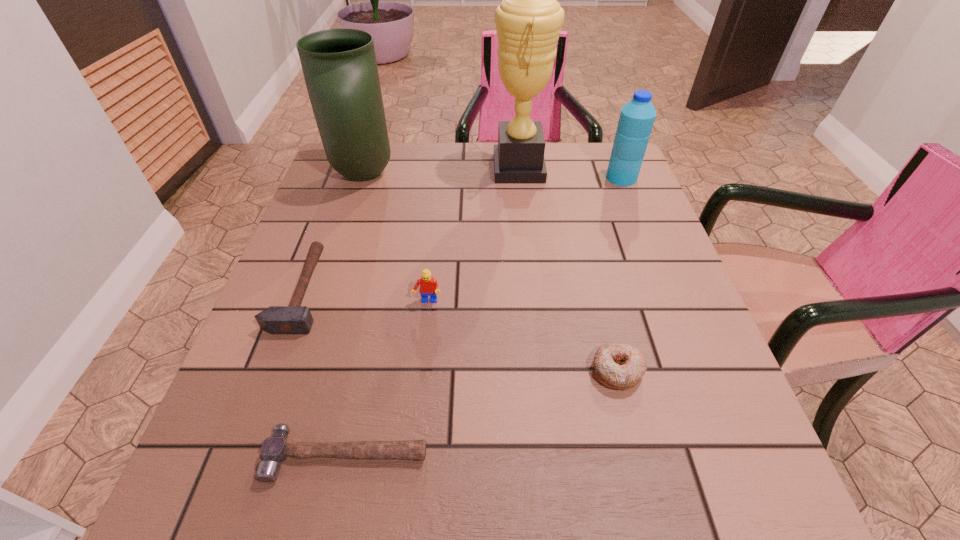
The width and height of the screenshot is (960, 540). In the image, there is a desktop. Find the location of `free space at the near edge`. free space at the near edge is located at coordinates (460, 485).

This screenshot has height=540, width=960. Identify the location of vacant point at the left edge. (343, 338).

The height and width of the screenshot is (540, 960). I want to click on free space at the right edge of the desktop, so click(659, 236).

In the image, there is a desktop. Identify the location of vacant space at the far left corner. (383, 173).

Locate an element on the screen. free space at the near left corner of the desktop is located at coordinates (214, 513).

The image size is (960, 540). Identify the location of free space at the far right corner. (608, 180).

What are the coordinates of `unoccupied area between the farther hammer and the fourth shortest object` in the screenshot? It's located at (365, 296).

Image resolution: width=960 pixels, height=540 pixels. Find the location of `free space between the sixth shortest object and the third tallest object`. free space between the sixth shortest object and the third tallest object is located at coordinates (492, 176).

The width and height of the screenshot is (960, 540). Find the location of `unoccupied position between the trophy cup and the rightmost object`. unoccupied position between the trophy cup and the rightmost object is located at coordinates (570, 173).

The image size is (960, 540). I want to click on free space between the rightmost object and the nearest object, so click(x=484, y=316).